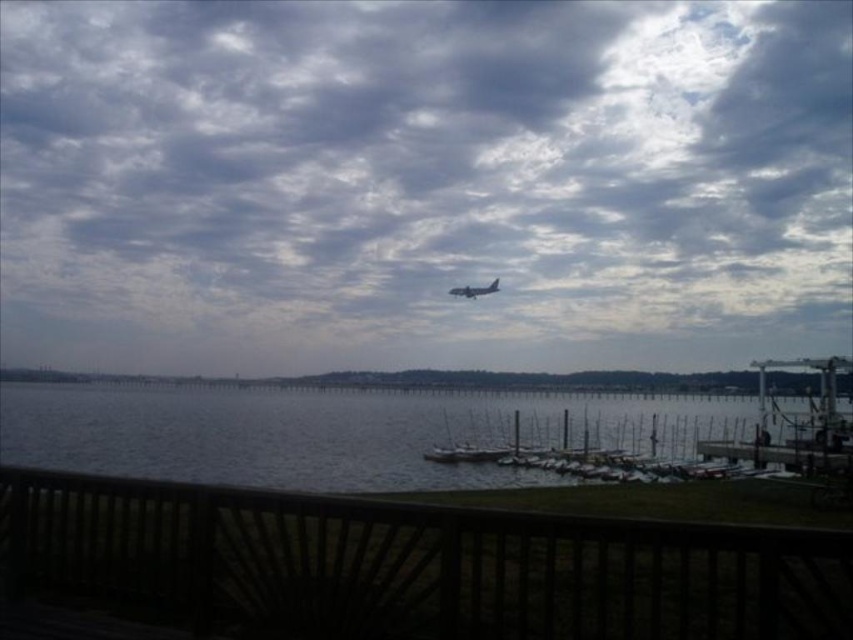
In the scene shown: You are standing on the wooden railing and want to look at two points in the scene. Which point is closer to you, point (447, 244) or point (300, 456)?

Point (300, 456) is closer to you because it is less further to the viewer than point (447, 244).

You are standing on the deck and looking at the cloudy sky at upper center and the gray water at lower center. Which object is positioned to the right side of the other?

The cloudy sky at upper center is to the right of gray water at lower center.